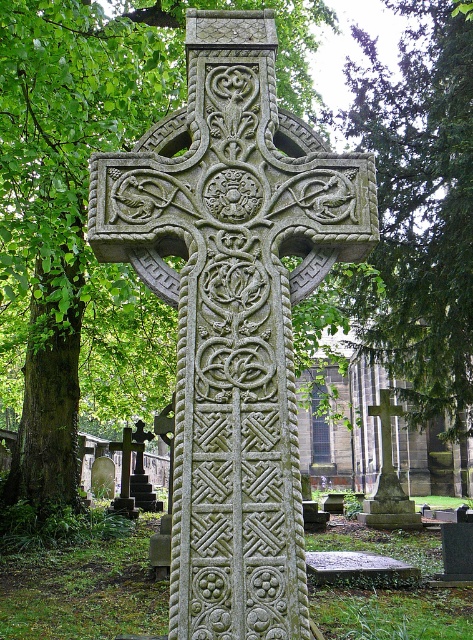
Is green leafy tree at center to the left of smooth stone cross at center from the viewer's perspective?

Indeed, green leafy tree at center is positioned on the left side of smooth stone cross at center.

Does green leafy tree at center lie behind smooth stone cross at center?

No.

Who is more forward, (130, 118) or (402, 524)?

Point (130, 118) is more forward.

Locate an element on the screen. This screenshot has width=473, height=640. green leafy tree at center is located at coordinates (86, 196).